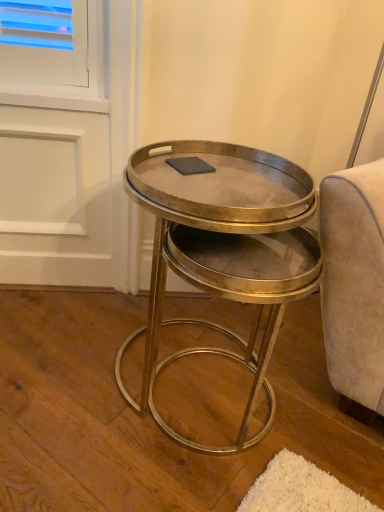
Question: Does shiny brass coffee table at center have a larger size compared to matte gray fabric at center?

Choices:
 (A) no
 (B) yes

Answer: (B)

Question: Does shiny brass coffee table at center have a smaller size compared to matte gray fabric at center?

Choices:
 (A) yes
 (B) no

Answer: (B)

Question: Could you tell me if shiny brass coffee table at center is facing matte gray fabric at center?

Choices:
 (A) no
 (B) yes

Answer: (A)

Question: Is shiny brass coffee table at center at the right side of matte gray fabric at center?

Choices:
 (A) yes
 (B) no

Answer: (A)

Question: Is shiny brass coffee table at center next to matte gray fabric at center and touching it?

Choices:
 (A) no
 (B) yes

Answer: (A)

Question: From the image's perspective, is shiny brass coffee table at center beneath matte gray fabric at center?

Choices:
 (A) yes
 (B) no

Answer: (A)

Question: Does matte gray fabric at center have a smaller size compared to shiny brass coffee table at center?

Choices:
 (A) yes
 (B) no

Answer: (A)

Question: Does matte gray fabric at center have a larger size compared to shiny brass coffee table at center?

Choices:
 (A) no
 (B) yes

Answer: (A)

Question: Is matte gray fabric at center not inside shiny brass coffee table at center?

Choices:
 (A) yes
 (B) no

Answer: (A)

Question: Is shiny brass coffee table at center at the back of matte gray fabric at center?

Choices:
 (A) no
 (B) yes

Answer: (A)

Question: Considering the relative sizes of matte gray fabric at center and shiny brass coffee table at center in the image provided, is matte gray fabric at center thinner than shiny brass coffee table at center?

Choices:
 (A) no
 (B) yes

Answer: (B)

Question: Is matte gray fabric at center shorter than shiny brass coffee table at center?

Choices:
 (A) yes
 (B) no

Answer: (A)

Question: In terms of width, does shiny brass coffee table at center look wider or thinner when compared to matte gray fabric at center?

Choices:
 (A) thin
 (B) wide

Answer: (B)